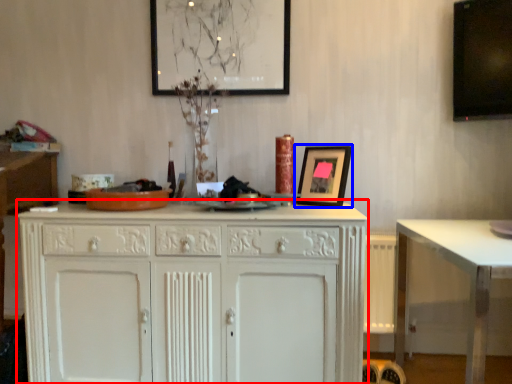
Question: Among these objects, which one is nearest to the camera, cabinetry (highlighted by a red box) or picture frame (highlighted by a blue box)?

Choices:
 (A) cabinetry
 (B) picture frame

Answer: (A)